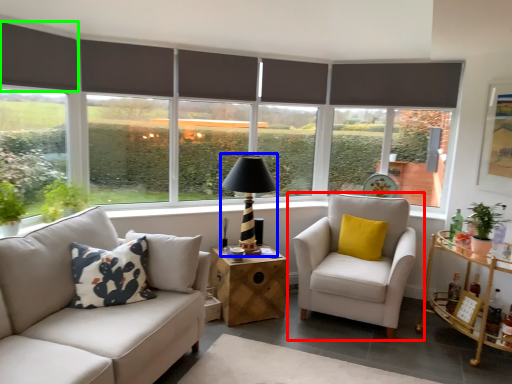
Question: Which object is the farthest from chair (highlighted by a red box)? Choose among these: table lamp (highlighted by a blue box) or shutter (highlighted by a green box).

Choices:
 (A) table lamp
 (B) shutter

Answer: (B)